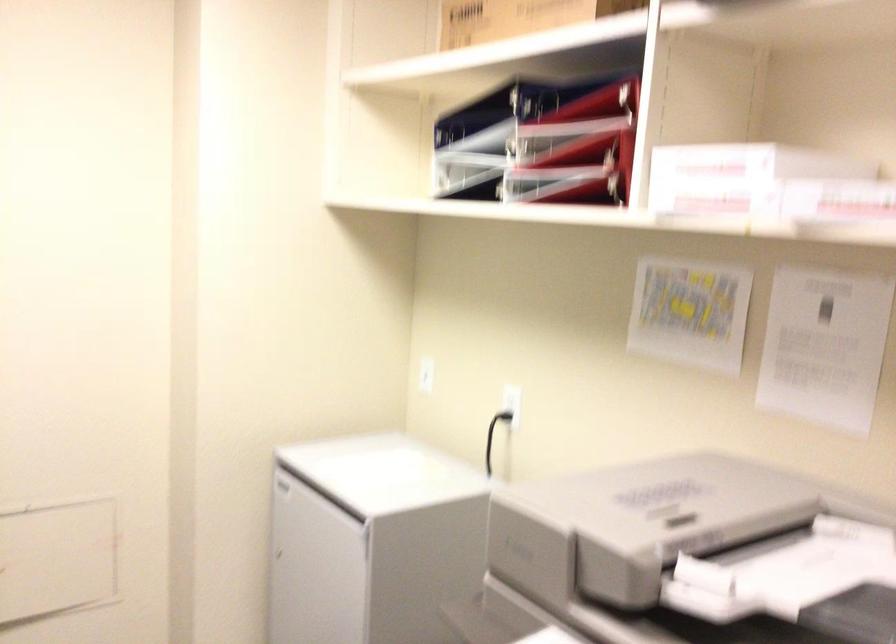
What do you see at coordinates (359, 456) in the screenshot? Image resolution: width=896 pixels, height=644 pixels. I see `the white freezer lid` at bounding box center [359, 456].